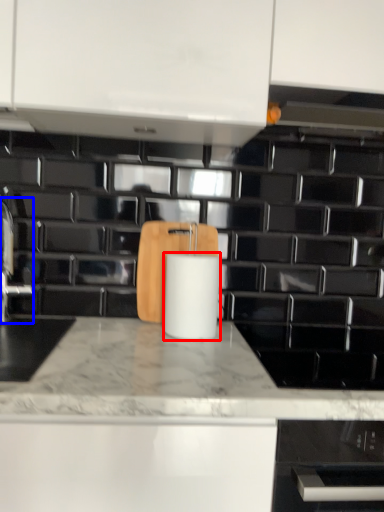
Question: Which object appears farthest to the camera in this image, paper towel (highlighted by a red box) or faucet (highlighted by a blue box)?

Choices:
 (A) paper towel
 (B) faucet

Answer: (B)